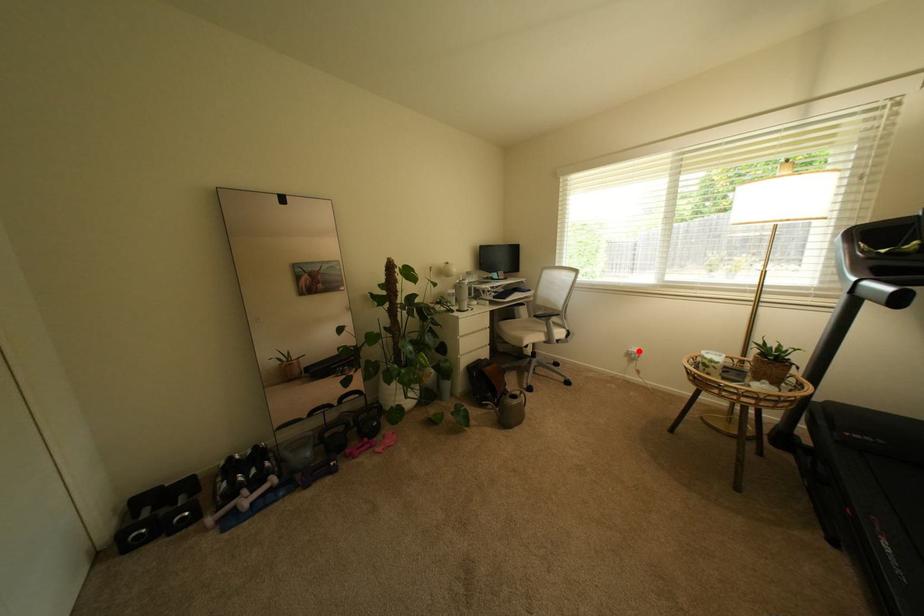
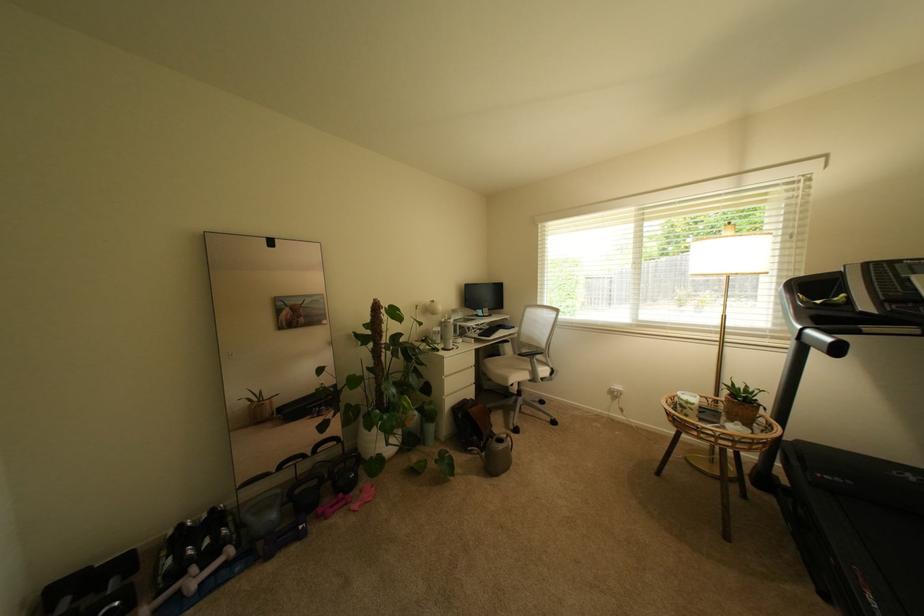
The point at the highlighted location is marked in the first image. Where is the corresponding point in the second image?

(622, 389)